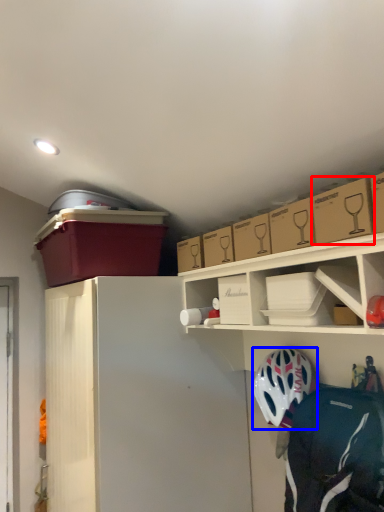
Question: Which object appears farthest to the camera in this image, cardboard box (highlighted by a red box) or helmet (highlighted by a blue box)?

Choices:
 (A) cardboard box
 (B) helmet

Answer: (B)